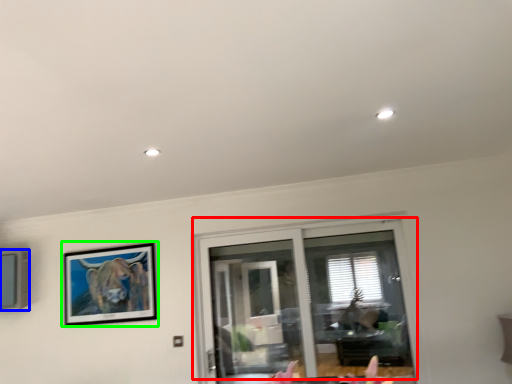
Question: Based on their relative distances, which object is farther from window (highlighted by a red box)? Choose from picture frame (highlighted by a blue box) and picture frame (highlighted by a green box).

Choices:
 (A) picture frame
 (B) picture frame

Answer: (A)